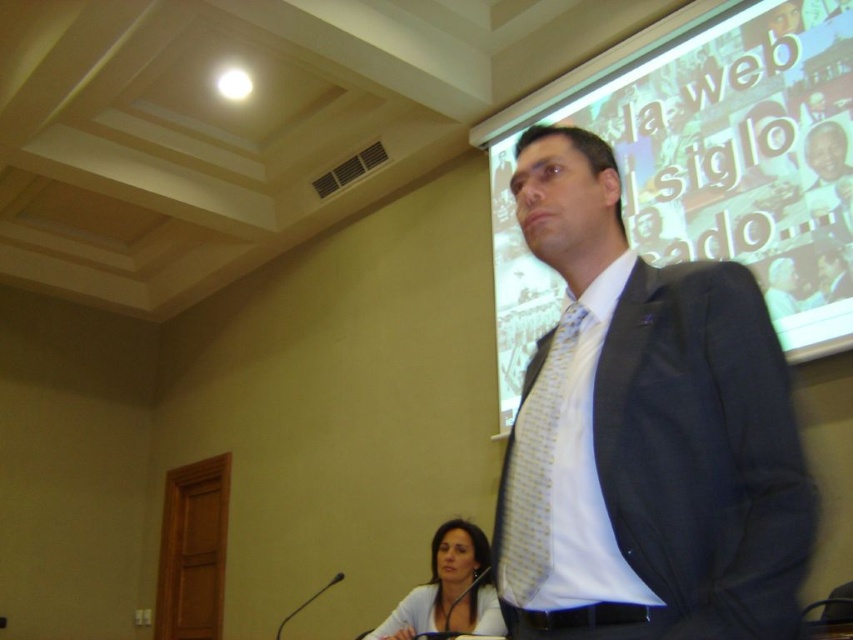
The width and height of the screenshot is (853, 640). Describe the element at coordinates (743, 154) in the screenshot. I see `matte white projection screen at upper right` at that location.

Which is more to the right, matte white projection screen at upper right or smooth white shirt at lower center?

matte white projection screen at upper right

Which is in front, point (796, 340) or point (463, 579)?

Point (796, 340)

Identify the location of matte white projection screen at upper right. (743, 154).

Does matte black suit at center come in front of smooth white shirt at lower center?

That is True.

Is point (526, 160) closer to camera compared to point (434, 580)?

Yes, point (526, 160) is closer to viewer.

Is point (723, 296) positioned behind point (440, 584)?

No, (723, 296) is in front of (440, 584).

Locate an element on the screen. Image resolution: width=853 pixels, height=640 pixels. matte black suit at center is located at coordinates (648, 428).

Can you confirm if matte black suit at center is positioned to the right of matte white projection screen at upper right?

No, matte black suit at center is not to the right of matte white projection screen at upper right.

At what (x,y) coordinates should I click in order to perform the action: click on matte black suit at center. Please return your answer as a coordinate pair (x, y). Looking at the image, I should click on (648, 428).

Where is `matte black suit at center`? This screenshot has height=640, width=853. matte black suit at center is located at coordinates (648, 428).